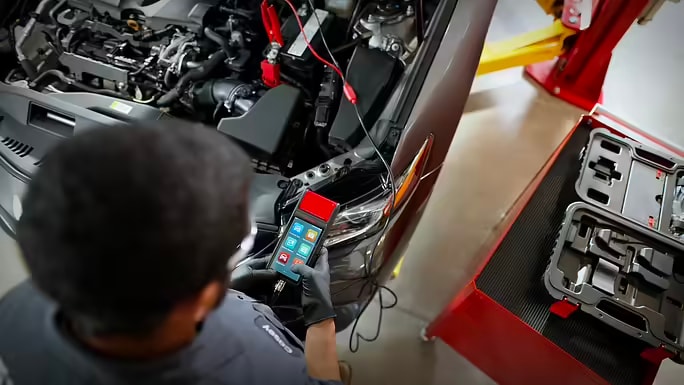
The width and height of the screenshot is (684, 385). What are the coordinates of `floor` in the screenshot? It's located at (508, 156).